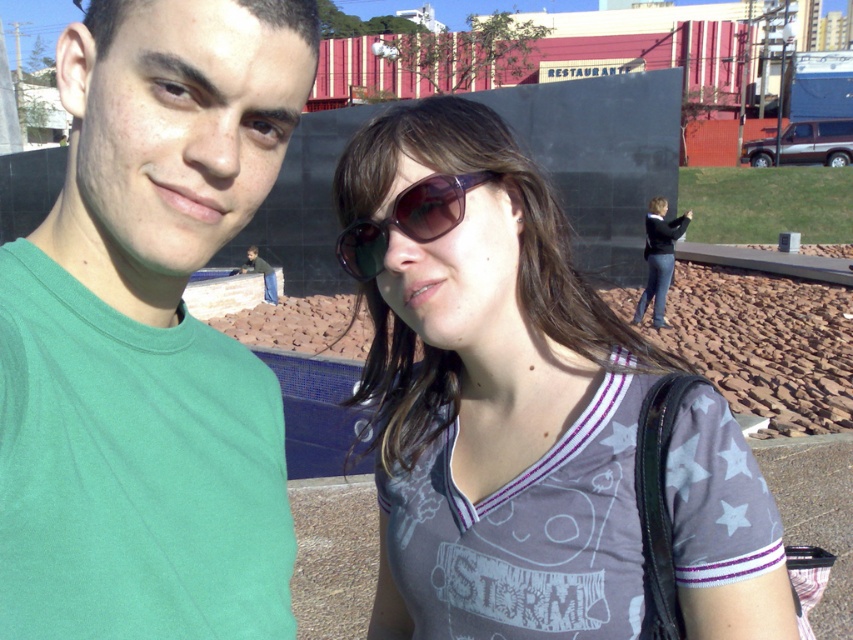
Question: Which of the following is the closest to the observer?

Choices:
 (A) (418, 241)
 (B) (161, 531)
 (C) (495, 170)

Answer: (B)

Question: Which is nearer to the matte gray shirt at center?

Choices:
 (A) sunglasses at center
 (B) green matte t-shirt at left

Answer: (A)

Question: Observing the image, what is the correct spatial positioning of matte gray shirt at center in reference to sunglasses at center?

Choices:
 (A) right
 (B) left

Answer: (A)

Question: Can you confirm if green matte t-shirt at left is positioned to the right of sunglasses at center?

Choices:
 (A) no
 (B) yes

Answer: (A)

Question: Which point is closer to the camera?

Choices:
 (A) matte gray shirt at center
 (B) sunglasses at center

Answer: (A)

Question: Where is green matte t-shirt at left located in relation to matte gray shirt at center in the image?

Choices:
 (A) right
 (B) left

Answer: (B)